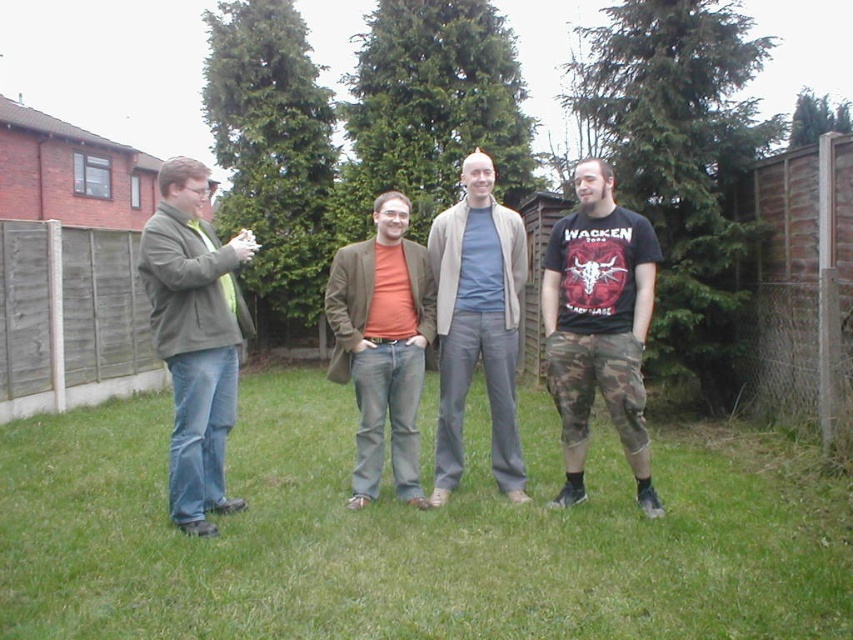
Question: In this image, where is green grass at lower center located relative to light gray cotton pants at center?

Choices:
 (A) above
 (B) below

Answer: (B)

Question: Estimate the real-world distances between objects in this image. Which object is farther from the matte brown blazer at center?

Choices:
 (A) green grass at lower center
 (B) matte green jacket at left
 (C) camo pants at center

Answer: (A)

Question: Which is farther from the light gray cotton pants at center?

Choices:
 (A) matte brown blazer at center
 (B) green grass at lower center

Answer: (B)

Question: Is camo pants at center below light gray cotton pants at center?

Choices:
 (A) no
 (B) yes

Answer: (B)

Question: Is matte green jacket at left below matte brown blazer at center?

Choices:
 (A) no
 (B) yes

Answer: (A)

Question: Which point is farther to the camera?

Choices:
 (A) matte brown blazer at center
 (B) green grass at lower center

Answer: (A)